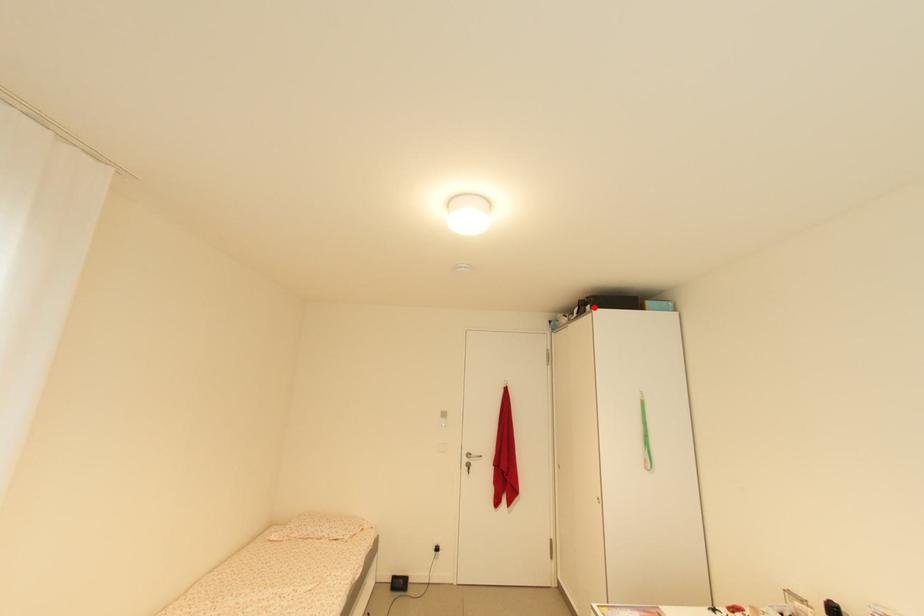
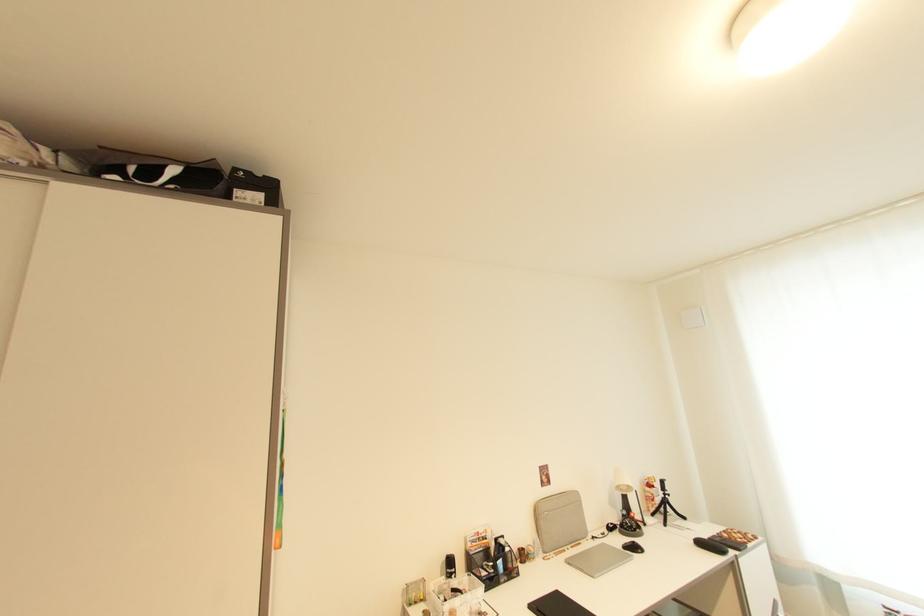
In the second image, find the point that corresponds to the highlighted location in the first image.

(264, 198)